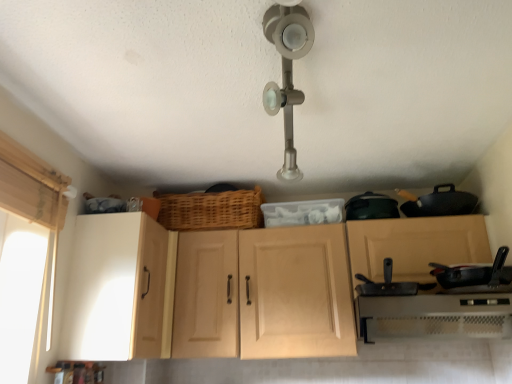
Where is `matte wood cabinet at center, placed as the first cabinetry when sorted from right to left`? Image resolution: width=512 pixels, height=384 pixels. matte wood cabinet at center, placed as the first cabinetry when sorted from right to left is located at coordinates (207, 291).

What do you see at coordinates (207, 291) in the screenshot? The width and height of the screenshot is (512, 384). I see `matte wood cabinet at center, placed as the first cabinetry when sorted from right to left` at bounding box center [207, 291].

The width and height of the screenshot is (512, 384). Find the location of `white matte cabinet at left, which is the 1th cabinetry from left to right`. white matte cabinet at left, which is the 1th cabinetry from left to right is located at coordinates (116, 288).

What do you see at coordinates (474, 273) in the screenshot? I see `black matte frying pan at lower right, which ranks as the first frying pan in right-to-left order` at bounding box center [474, 273].

Image resolution: width=512 pixels, height=384 pixels. I want to click on white plastic oven at lower right, so click(x=434, y=316).

What are the coordinates of `matte wood cabinet at center, marked as the second cabinetry in a left-to-right arrangement` in the screenshot? It's located at (207, 291).

Is woven wood basket at center surrounding satin nickel light fixture at upper center?

Actually, satin nickel light fixture at upper center is outside woven wood basket at center.

Between woven wood basket at center and satin nickel light fixture at upper center, which one appears on the left side from the viewer's perspective?

From the viewer's perspective, woven wood basket at center appears more on the left side.

Does woven wood basket at center have a greater width compared to satin nickel light fixture at upper center?

Yes, woven wood basket at center is wider than satin nickel light fixture at upper center.

At what (x,y) coordinates should I click in order to perform the action: click on cabinetry in front of the white plastic oven at lower right. Please return your answer as a coordinate pair (x, y). The width and height of the screenshot is (512, 384). Looking at the image, I should click on (207, 291).

Can you see white plastic oven at lower right touching matte wood cabinet at center, marked as the second cabinetry in a left-to-right arrangement?

There is a gap between white plastic oven at lower right and matte wood cabinet at center, marked as the second cabinetry in a left-to-right arrangement.

From a real-world perspective, is white plastic oven at lower right located higher than matte wood cabinet at center, placed as the first cabinetry when sorted from right to left?

No, from a real-world perspective, white plastic oven at lower right is not on top of matte wood cabinet at center, placed as the first cabinetry when sorted from right to left.

Does white plastic oven at lower right have a smaller size compared to matte wood cabinet at center, marked as the second cabinetry in a left-to-right arrangement?

Yes.

Is black matte frying pan at lower right, which ranks as the first frying pan in right-to-left order, shorter than white plastic oven at lower right?

Yes, black matte frying pan at lower right, which ranks as the first frying pan in right-to-left order, is shorter than white plastic oven at lower right.

Can you see black matte frying pan at lower right, which ranks as the first frying pan in right-to-left order, touching white plastic oven at lower right?

They are not placed beside each other.

Which object is wider, black matte frying pan at lower right, which ranks as the first frying pan in right-to-left order, or white plastic oven at lower right?

With larger width is white plastic oven at lower right.

Can you confirm if woven wood basket at center is bigger than white matte cabinet at left, marked as the 2th cabinetry in a right-to-left arrangement?

Incorrect, woven wood basket at center is not larger than white matte cabinet at left, marked as the 2th cabinetry in a right-to-left arrangement.

Which object is positioned more to the left, woven wood basket at center or white matte cabinet at left, marked as the 2th cabinetry in a right-to-left arrangement?

From the viewer's perspective, white matte cabinet at left, marked as the 2th cabinetry in a right-to-left arrangement, appears more on the left side.

I want to click on basket that is on the right side of white matte cabinet at left, marked as the 2th cabinetry in a right-to-left arrangement, so click(x=211, y=210).

Based on the photo, from a real-world perspective, which object stands above the other?

woven wood basket at center.

Is white fabric at left aimed at white plastic oven at lower right?

Yes, white fabric at left is turned towards white plastic oven at lower right.

Considering the sizes of white fabric at left and white plastic oven at lower right in the image, is white fabric at left taller or shorter than white plastic oven at lower right?

Clearly, white fabric at left is taller compared to white plastic oven at lower right.

From a real-world perspective, which is physically above, white fabric at left or white plastic oven at lower right?

white fabric at left.

Does point (16, 264) come in front of point (387, 309)?

Yes, point (16, 264) is in front of point (387, 309).

Can you tell me how much white matte cabinet at left, marked as the 2th cabinetry in a right-to-left arrangement, and woven wood basket at center differ in facing direction?

The angular difference between white matte cabinet at left, marked as the 2th cabinetry in a right-to-left arrangement, and woven wood basket at center is 95.8 degrees.

I want to click on basket behind the white matte cabinet at left, which is the 1th cabinetry from left to right, so click(x=211, y=210).

Is white matte cabinet at left, which is the 1th cabinetry from left to right, at the left side of woven wood basket at center?

Yes, white matte cabinet at left, which is the 1th cabinetry from left to right, is to the left of woven wood basket at center.

Is white matte cabinet at left, marked as the 2th cabinetry in a right-to-left arrangement, turned away from woven wood basket at center?

No.

Is satin nickel light fixture at upper center directly adjacent to woven wood basket at center?

No, satin nickel light fixture at upper center is not beside woven wood basket at center.

Which of these two, satin nickel light fixture at upper center or woven wood basket at center, is wider?

Wider between the two is woven wood basket at center.

How much distance is there between satin nickel light fixture at upper center and woven wood basket at center?

A distance of 28.97 inches exists between satin nickel light fixture at upper center and woven wood basket at center.

Looking at this image, is satin nickel light fixture at upper center oriented towards woven wood basket at center?

No, satin nickel light fixture at upper center does not turn towards woven wood basket at center.

Where is `light fixture lying on the right of woven wood basket at center`? light fixture lying on the right of woven wood basket at center is located at coordinates click(287, 72).

At what (x,y) coordinates should I click in order to perform the action: click on cabinetry in front of the white plastic oven at lower right. Please return your answer as a coordinate pair (x, y). Looking at the image, I should click on (207, 291).

Which object lies further to the anchor point woven wood basket at center, white matte cabinet at left, which is the 1th cabinetry from left to right, or black matte frying pan at center, which ranks as the first frying pan in left-to-right order?

black matte frying pan at center, which ranks as the first frying pan in left-to-right order, is positioned further to the anchor woven wood basket at center.

From the image, which object appears to be nearer to white plastic oven at lower right, satin nickel light fixture at upper center or woven wood basket at center?

woven wood basket at center is closer to white plastic oven at lower right.

When comparing their distances from satin nickel light fixture at upper center, does black matte frying pan at center, which is counted as the second frying pan, starting from the right, or matte wood cabinet at center, placed as the first cabinetry when sorted from right to left, seem closer?

The object closer to satin nickel light fixture at upper center is black matte frying pan at center, which is counted as the second frying pan, starting from the right.

Looking at this image, looking at the image, which one is located closer to white matte cabinet at left, which is the 1th cabinetry from left to right, white plastic oven at lower right or black matte frying pan at center, which is counted as the second frying pan, starting from the right?

black matte frying pan at center, which is counted as the second frying pan, starting from the right.

Based on their spatial positions, is white matte cabinet at left, which is the 1th cabinetry from left to right, or white plastic oven at lower right further from black matte frying pan at center, which ranks as the first frying pan in left-to-right order?

Among the two, white matte cabinet at left, which is the 1th cabinetry from left to right, is located further to black matte frying pan at center, which ranks as the first frying pan in left-to-right order.

Looking at this image, looking at the image, which one is located further to black matte frying pan at lower right, placed as the 2th frying pan when sorted from left to right, satin nickel light fixture at upper center or white matte cabinet at left, which is the 1th cabinetry from left to right?

The object further to black matte frying pan at lower right, placed as the 2th frying pan when sorted from left to right, is white matte cabinet at left, which is the 1th cabinetry from left to right.

Which object lies further to the anchor point black matte frying pan at center, which ranks as the first frying pan in left-to-right order, black matte frying pan at lower right, which ranks as the first frying pan in right-to-left order, or woven wood basket at center?

woven wood basket at center is positioned further to the anchor black matte frying pan at center, which ranks as the first frying pan in left-to-right order.

From the image, which object appears to be farther from black matte frying pan at lower right, placed as the 2th frying pan when sorted from left to right, black matte frying pan at center, which ranks as the first frying pan in left-to-right order, or woven wood basket at center?

Based on the image, woven wood basket at center appears to be further to black matte frying pan at lower right, placed as the 2th frying pan when sorted from left to right.

Find the location of `light fixture between white matte cabinet at left, marked as the 2th cabinetry in a right-to-left arrangement, and black matte frying pan at lower right, placed as the 2th frying pan when sorted from left to right, in the horizontal direction`. light fixture between white matte cabinet at left, marked as the 2th cabinetry in a right-to-left arrangement, and black matte frying pan at lower right, placed as the 2th frying pan when sorted from left to right, in the horizontal direction is located at coordinates (287, 72).

Where is `oven between white fabric at left and black matte frying pan at lower right, which ranks as the first frying pan in right-to-left order`? Image resolution: width=512 pixels, height=384 pixels. oven between white fabric at left and black matte frying pan at lower right, which ranks as the first frying pan in right-to-left order is located at coordinates (434, 316).

The image size is (512, 384). Find the location of `basket between white matte cabinet at left, which is the 1th cabinetry from left to right, and black matte frying pan at lower right, which ranks as the first frying pan in right-to-left order, from left to right`. basket between white matte cabinet at left, which is the 1th cabinetry from left to right, and black matte frying pan at lower right, which ranks as the first frying pan in right-to-left order, from left to right is located at coordinates coord(211,210).

Where is `basket located between white matte cabinet at left, marked as the 2th cabinetry in a right-to-left arrangement, and matte wood cabinet at center, placed as the first cabinetry when sorted from right to left, in the left-right direction`? Image resolution: width=512 pixels, height=384 pixels. basket located between white matte cabinet at left, marked as the 2th cabinetry in a right-to-left arrangement, and matte wood cabinet at center, placed as the first cabinetry when sorted from right to left, in the left-right direction is located at coordinates (211, 210).